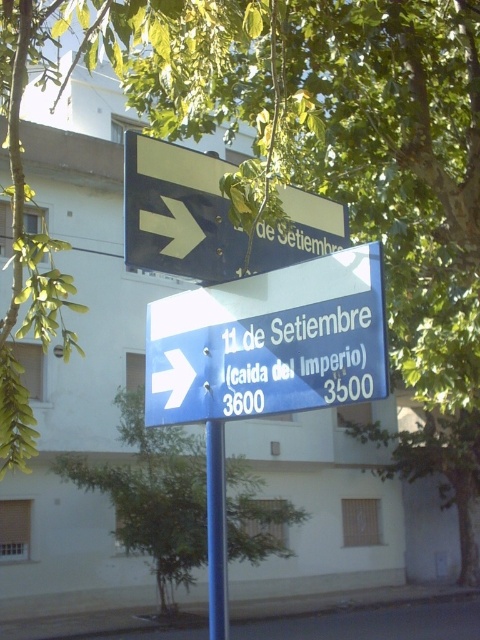
Which is behind, point (245, 540) or point (167, 371)?

The point (245, 540) is more distant.

Who is shorter, green leafy tree at lower center or white plastic arrow at center?

white plastic arrow at center is shorter.

Identify the location of green leafy tree at lower center. (152, 496).

At what (x,y) coordinates should I click in order to perform the action: click on green leafy tree at lower center. Please return your answer as a coordinate pair (x, y). This screenshot has height=640, width=480. Looking at the image, I should click on coord(152,496).

Between point (283, 250) and point (157, 218), which one is positioned in front?

Point (157, 218) is more forward.

You are a GUI agent. You are given a task and a screenshot of the screen. Output one action in this format:
    pyautogui.click(x=<x>, y=<y>)
    Task: Click on the black plastic sign at upper right
    The image size is (480, 640).
    Given the screenshot: What is the action you would take?
    pyautogui.click(x=178, y=212)

Is point (272, 268) closer to camera compared to point (162, 234)?

No, it is not.

The height and width of the screenshot is (640, 480). I want to click on black plastic sign at upper right, so click(x=178, y=212).

The width and height of the screenshot is (480, 640). What do you see at coordinates (269, 342) in the screenshot? I see `blue plastic sign at center` at bounding box center [269, 342].

Is blue plastic sign at center positioned before white plastic arrow at center?

Yes, blue plastic sign at center is in front of white plastic arrow at center.

Locate an element on the screen. This screenshot has width=480, height=640. blue plastic sign at center is located at coordinates (269, 342).